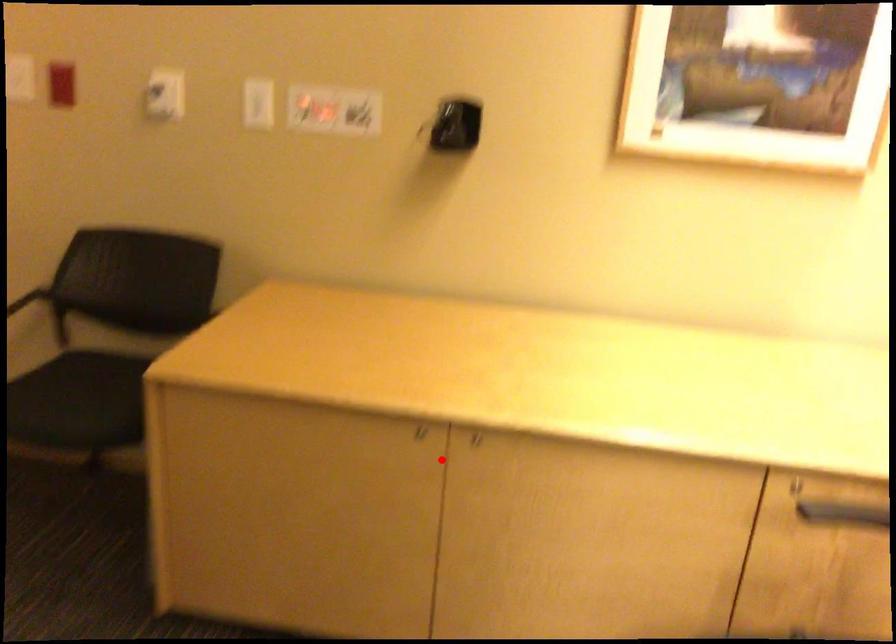
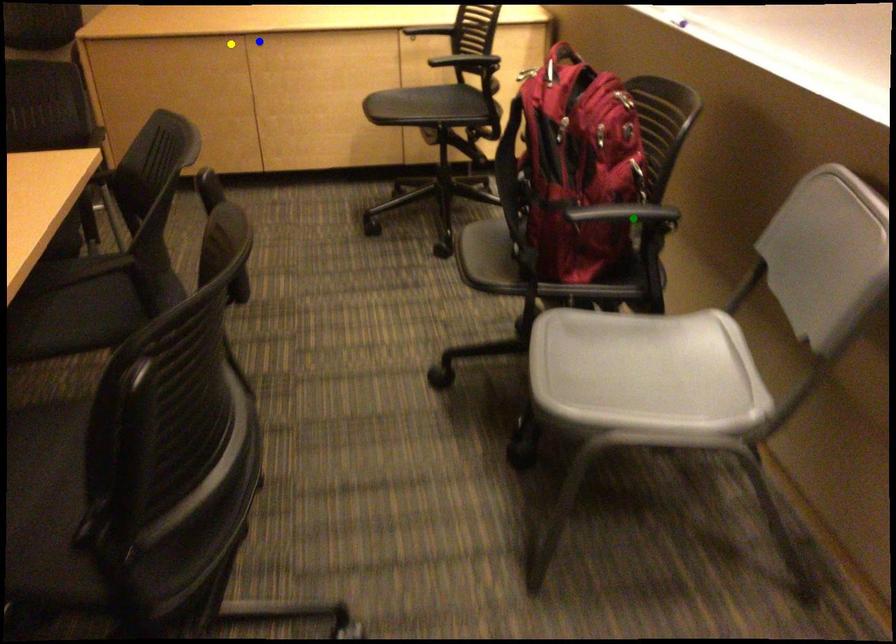
Question: I am providing you with two images of the same scene from different viewpoints. A red point is marked on the first image. You are given multiple points on the second image. Which point in image 2 represents the same 3d spot as the red point in image 1?

Choices:
 (A) green point
 (B) yellow point
 (C) blue point

Answer: (B)